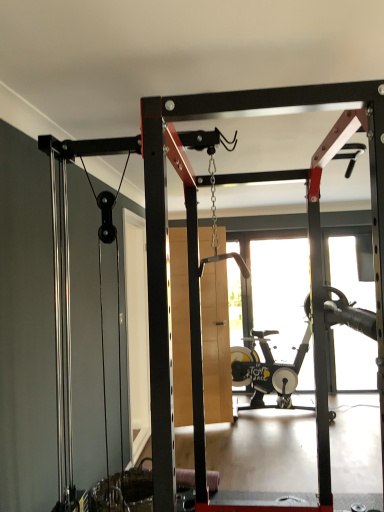
What do you see at coordinates (269, 369) in the screenshot? The width and height of the screenshot is (384, 512). I see `black rubber stationary bicycle at center` at bounding box center [269, 369].

Where is `black rubber stationary bicycle at center`? Image resolution: width=384 pixels, height=512 pixels. black rubber stationary bicycle at center is located at coordinates (x=269, y=369).

Describe the element at coordinates (216, 344) in the screenshot. I see `wooden at center` at that location.

This screenshot has width=384, height=512. I want to click on wooden at center, so click(x=216, y=344).

Where is `black rubber stationary bicycle at center`? The width and height of the screenshot is (384, 512). black rubber stationary bicycle at center is located at coordinates (269, 369).

Considering the positions of objects wooden at center and black rubber stationary bicycle at center in the image provided, who is more to the left, wooden at center or black rubber stationary bicycle at center?

wooden at center is more to the left.

Considering the relative positions of wooden at center and black rubber stationary bicycle at center in the image provided, is wooden at center behind black rubber stationary bicycle at center?

No.

Does point (209, 352) lie behind point (338, 321)?

That is True.

From the image's perspective, is wooden at center above or below black rubber stationary bicycle at center?

wooden at center is above black rubber stationary bicycle at center.

From a real-world perspective, which object rests below the other?

black rubber stationary bicycle at center is physically lower.

Considering the sizes of objects wooden at center and black rubber stationary bicycle at center in the image provided, who is wider, wooden at center or black rubber stationary bicycle at center?

Wider between the two is black rubber stationary bicycle at center.

From their relative heights in the image, would you say wooden at center is taller or shorter than black rubber stationary bicycle at center?

In the image, wooden at center appears to be taller than black rubber stationary bicycle at center.

Considering the sizes of objects wooden at center and black rubber stationary bicycle at center in the image provided, who is smaller, wooden at center or black rubber stationary bicycle at center?

With smaller size is wooden at center.

Is wooden at center inside or outside of black rubber stationary bicycle at center?

wooden at center cannot be found inside black rubber stationary bicycle at center.

Is wooden at center beside black rubber stationary bicycle at center?

No, wooden at center is not touching black rubber stationary bicycle at center.

In the scene shown: Is wooden at center turned away from black rubber stationary bicycle at center?

wooden at center does not have its back to black rubber stationary bicycle at center.

How distant is wooden at center from black rubber stationary bicycle at center?

wooden at center is 28.88 inches away from black rubber stationary bicycle at center.

Where is `garage door to the left of black rubber stationary bicycle at center`? garage door to the left of black rubber stationary bicycle at center is located at coordinates (216, 344).

Considering the relative positions of black rubber stationary bicycle at center and wooden at center in the image provided, is black rubber stationary bicycle at center to the right of wooden at center from the viewer's perspective?

Yes, black rubber stationary bicycle at center is to the right of wooden at center.

Who is more distant, black rubber stationary bicycle at center or wooden at center?

black rubber stationary bicycle at center is further from the camera.

Between point (302, 409) and point (208, 329), which one is positioned in front?

The point (208, 329) is closer to the camera.

From the image's perspective, is black rubber stationary bicycle at center above or below wooden at center?

Clearly, from the image's perspective, black rubber stationary bicycle at center is below wooden at center.

From a real-world perspective, which is physically below, black rubber stationary bicycle at center or wooden at center?

black rubber stationary bicycle at center is physically lower.

Considering the relative sizes of black rubber stationary bicycle at center and wooden at center in the image provided, is black rubber stationary bicycle at center wider than wooden at center?

Yes.

Does black rubber stationary bicycle at center have a lesser height compared to wooden at center?

Correct, black rubber stationary bicycle at center is not as tall as wooden at center.

Which of these two, black rubber stationary bicycle at center or wooden at center, is bigger?

black rubber stationary bicycle at center is bigger.

Based on the photo, is wooden at center inside black rubber stationary bicycle at center?

That's incorrect, wooden at center is not inside black rubber stationary bicycle at center.

Are black rubber stationary bicycle at center and wooden at center located far from each other?

No, there isn't a large distance between black rubber stationary bicycle at center and wooden at center.

Does black rubber stationary bicycle at center turn towards wooden at center?

No, black rubber stationary bicycle at center is not turned towards wooden at center.

This screenshot has height=512, width=384. I want to click on garage door above the black rubber stationary bicycle at center (from a real-world perspective), so click(x=216, y=344).

In the image, there is a black rubber stationary bicycle at center. At what (x,y) coordinates should I click in order to perform the action: click on garage door above it (from the image's perspective). Please return your answer as a coordinate pair (x, y). Looking at the image, I should click on (216, 344).

Identify the location of garage door located in front of the black rubber stationary bicycle at center. This screenshot has width=384, height=512. (216, 344).